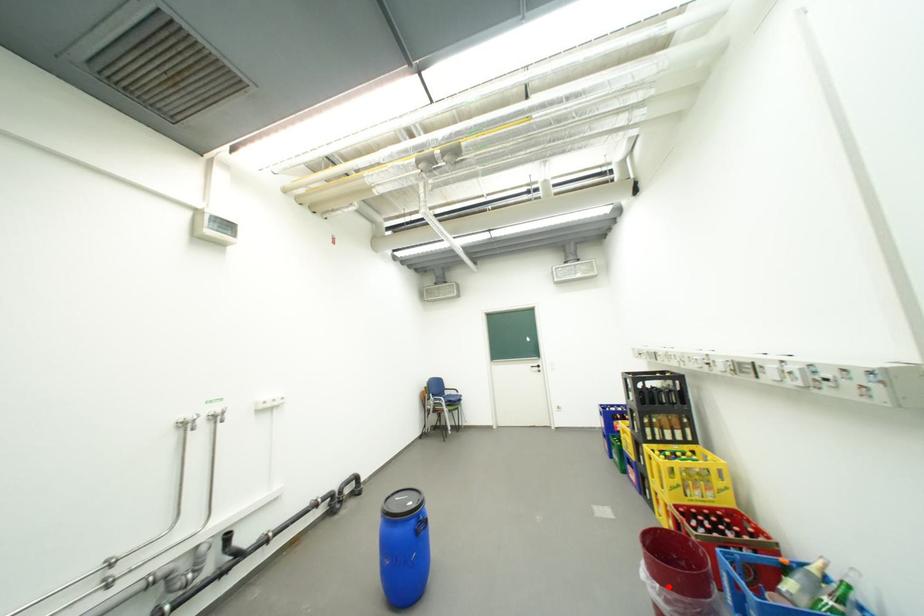
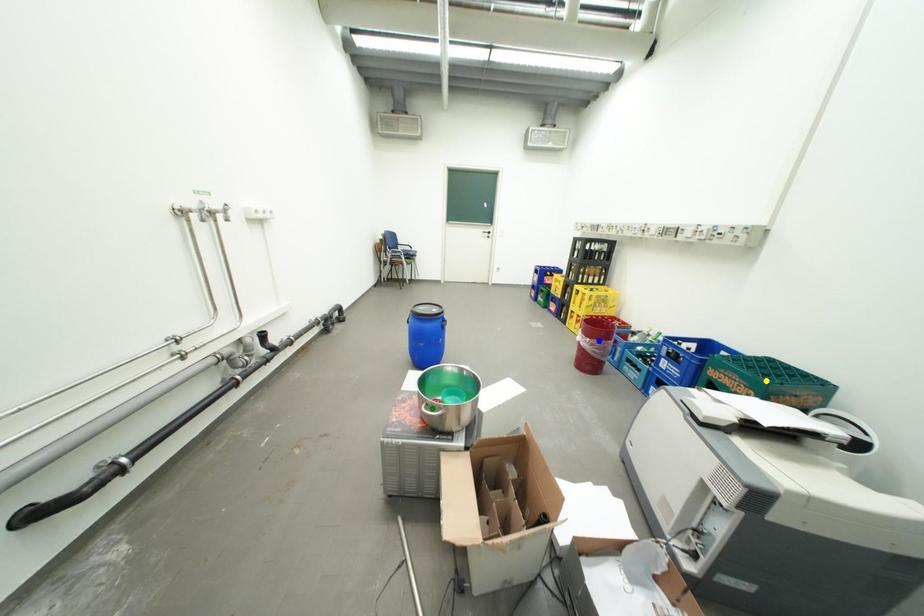
Question: I am providing you with two images of the same scene from different viewpoints. A red point is marked on the first image. You are given multiple points on the second image. In image 2, which mark is for the same physical point as the one in image 1?

Choices:
 (A) blue point
 (B) green point
 (C) yellow point

Answer: (A)